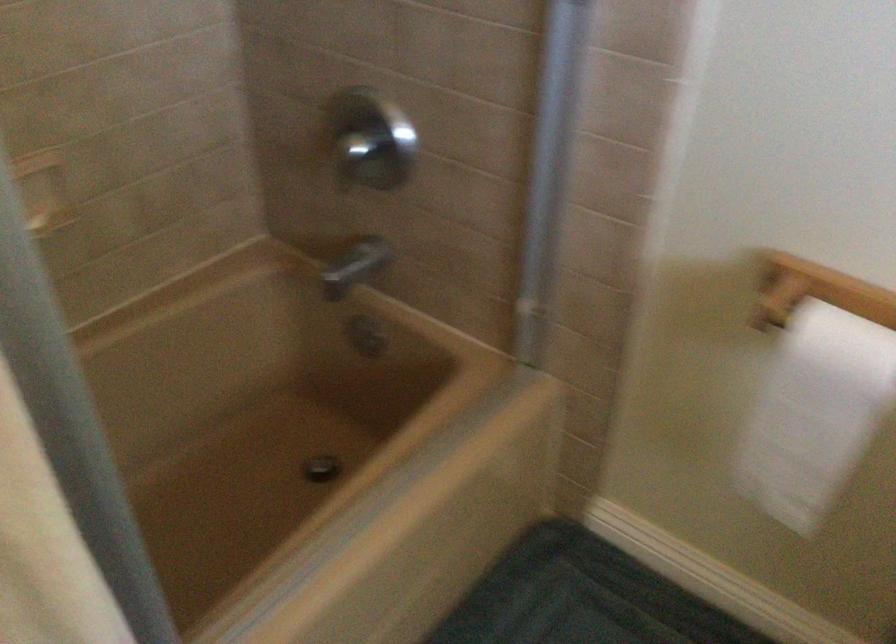
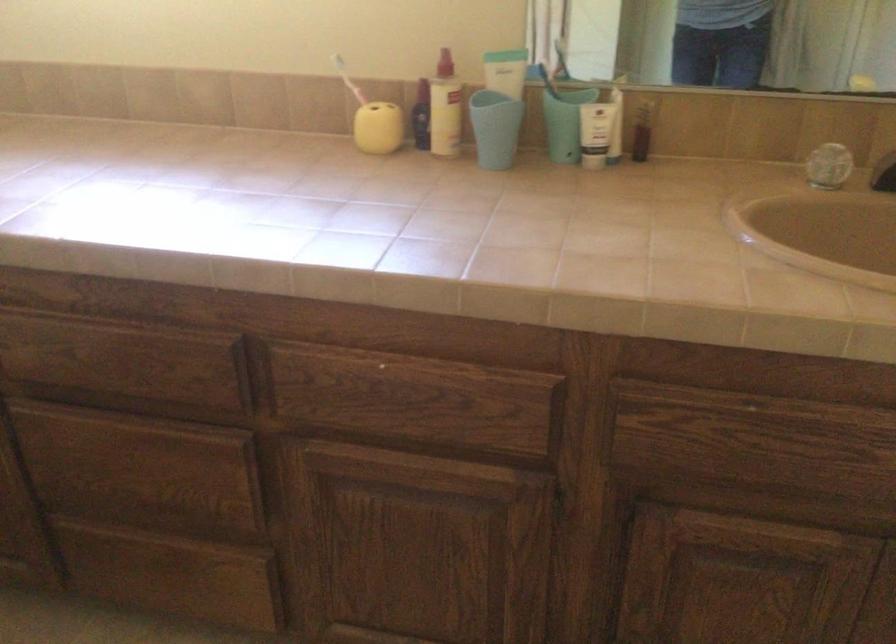
How did the camera likely rotate?

The rotation direction of the camera is right-down.